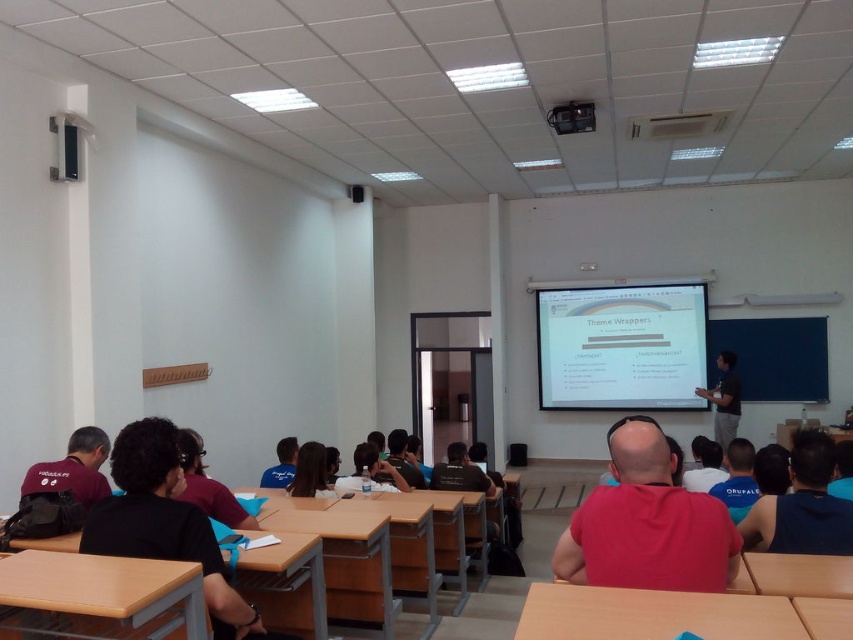
Between wooden table at lower center and blue fabric shirt at lower center, which one appears on the right side from the viewer's perspective?

wooden table at lower center is more to the right.

Is wooden table at lower center below blue fabric shirt at lower center?

No.

Identify the location of wooden table at lower center. (653, 614).

Who is positioned more to the left, wooden table at lower left or matte black shirt at lower left?

Positioned to the left is matte black shirt at lower left.

Is wooden table at lower left positioned before matte black shirt at lower left?

Yes, it is in front of matte black shirt at lower left.

Is point (190, 584) farther from viewer compared to point (55, 486)?

No.

You are a GUI agent. You are given a task and a screenshot of the screen. Output one action in this format:
    pyautogui.click(x=<x>, y=<y>)
    Task: Click on the wooden table at lower left
    Image resolution: width=853 pixels, height=640 pixels.
    Given the screenshot: What is the action you would take?
    pyautogui.click(x=99, y=596)

Is point (793, 582) positioned in front of point (86, 449)?

That is True.

Is wooden table at lower right positioned behind matte black shirt at lower left?

No, wooden table at lower right is in front of matte black shirt at lower left.

What are the coordinates of `wooden table at lower right` in the screenshot? It's located at (798, 573).

The width and height of the screenshot is (853, 640). In order to click on wooden table at lower right in this screenshot , I will do `click(798, 573)`.